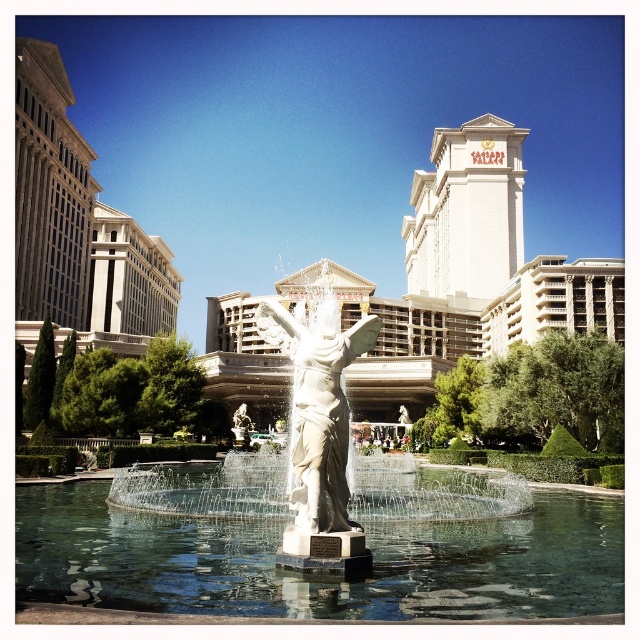
Consider the image. Is clear glass water at center taller than white marble statue at center?

No.

Is point (28, 513) closer to camera compared to point (316, 387)?

No, it is not.

This screenshot has width=640, height=640. I want to click on clear glass water at center, so click(321, 573).

Is white marble fountain at center wider than white marble statue at center?

Yes, white marble fountain at center is wider than white marble statue at center.

Does white marble fountain at center appear on the right side of white marble statue at center?

No, white marble fountain at center is not to the right of white marble statue at center.

Find the location of a particular element. The height and width of the screenshot is (640, 640). white marble fountain at center is located at coordinates (316, 456).

Does point (248, 561) lie in front of point (490, 490)?

Yes, it is in front of point (490, 490).

Between clear glass water at center and white marble fountain at center, which one is positioned higher?

white marble fountain at center is higher up.

Between point (369, 545) and point (304, 326), which one is positioned behind?

The point (304, 326) is more distant.

Identify the location of clear glass water at center. (321, 573).